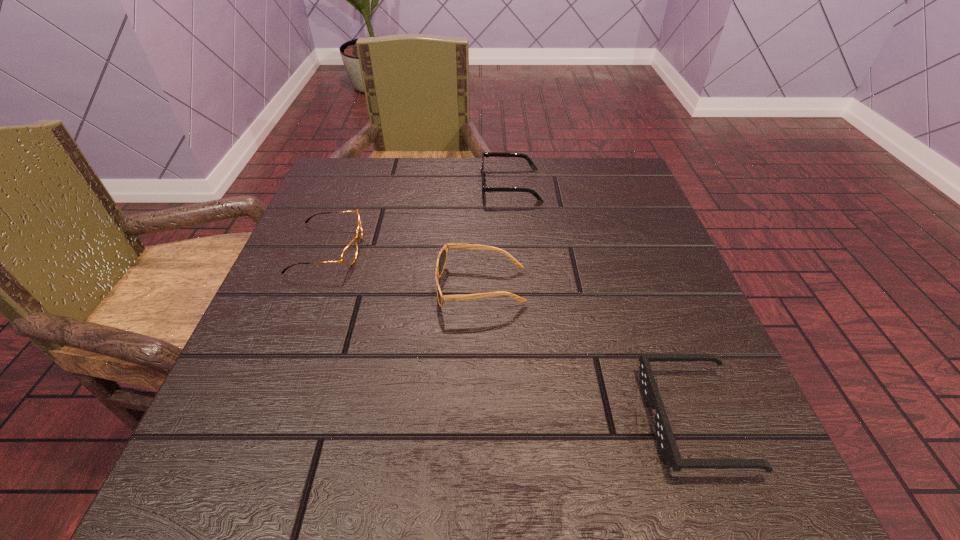
Locate an element on the screen. This screenshot has width=960, height=540. free region at the far edge of the desktop is located at coordinates (468, 166).

At what (x,y) coordinates should I click in order to perform the action: click on vacant space at the near edge of the desktop. Please return your answer as a coordinate pair (x, y). Looking at the image, I should click on pyautogui.click(x=575, y=459).

Image resolution: width=960 pixels, height=540 pixels. Identify the location of free spot at the left edge of the desktop. (280, 383).

At what (x,y) coordinates should I click in order to perform the action: click on vacant area at the right edge of the desktop. Please return your answer as a coordinate pair (x, y). Looking at the image, I should click on (722, 392).

I want to click on free space at the far left corner of the desktop, so click(393, 180).

Locate an element on the screen. The height and width of the screenshot is (540, 960). vacant region at the far right corner is located at coordinates (598, 212).

Find the location of a particular element. free space that is in between the farthest object and the spectacles is located at coordinates (420, 217).

Where is `free area in between the spectacles and the second farthest sunglasses`? The height and width of the screenshot is (540, 960). free area in between the spectacles and the second farthest sunglasses is located at coordinates point(404,268).

You are a GUI agent. You are given a task and a screenshot of the screen. Output one action in this format:
    pyautogui.click(x=<x>, y=<y>)
    Task: Click on the empty space that is in between the shortest object and the second nearest sunglasses
    Image resolution: width=960 pixels, height=540 pixels.
    Given the screenshot: What is the action you would take?
    pyautogui.click(x=588, y=353)

You are a GUI agent. You are given a task and a screenshot of the screen. Output one action in this format:
    pyautogui.click(x=<x>, y=<y>)
    Task: Click on the vacant space in between the nearest object and the second farthest sunglasses
    Image resolution: width=960 pixels, height=540 pixels.
    Given the screenshot: What is the action you would take?
    pyautogui.click(x=588, y=353)